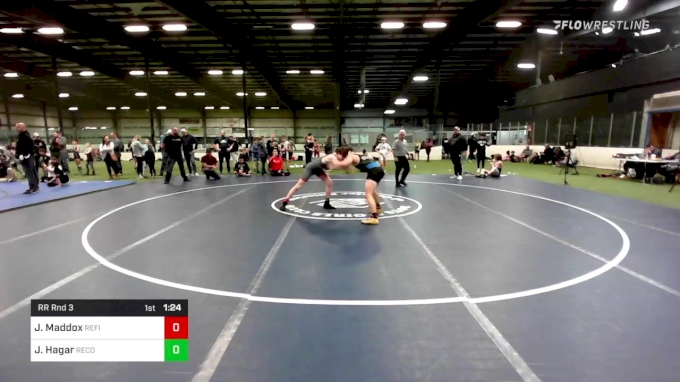
Identify the location of floor. The image size is (680, 382). (585, 183).